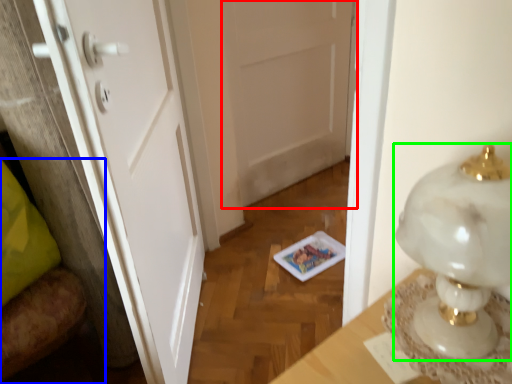
Question: Which object is positioned farthest from door (highlighted by a red box)? Select from furniture (highlighted by a blue box) and lamp (highlighted by a green box).

Choices:
 (A) furniture
 (B) lamp

Answer: (B)